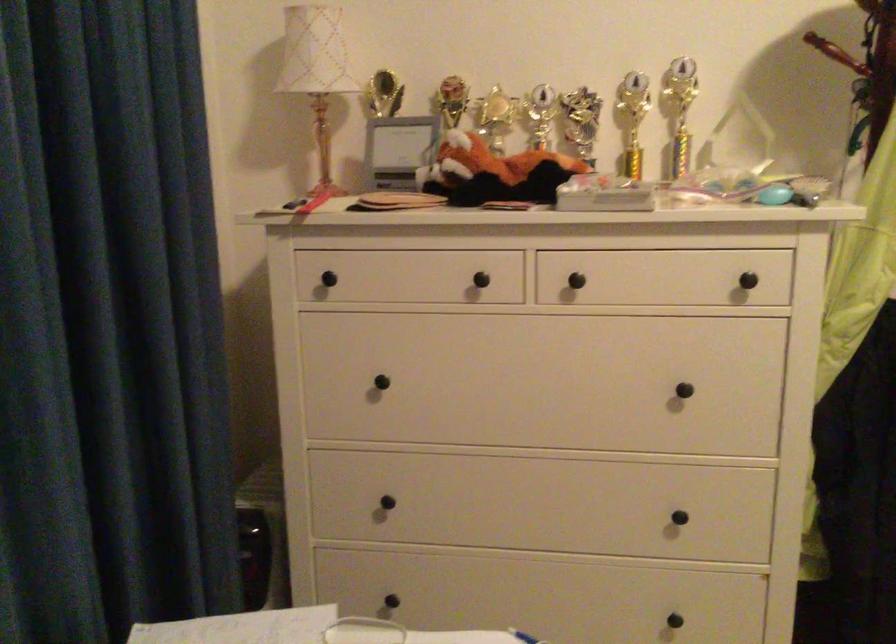
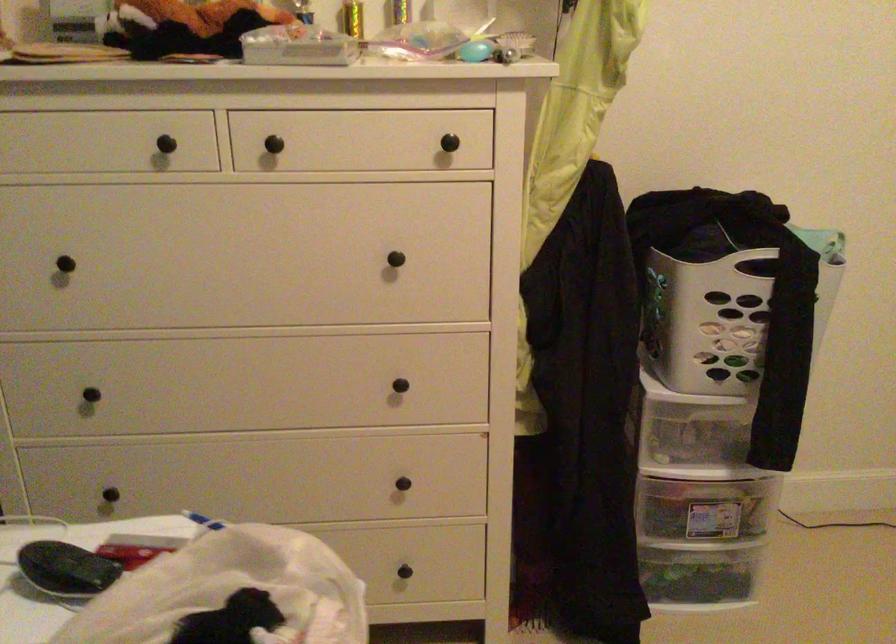
Find the pixel in the second image that matches (487,278) in the first image.

(173, 142)